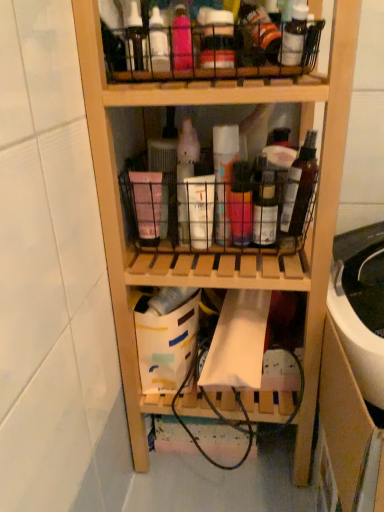
Question: From a real-world perspective, is metallic wire basket at upper center, marked as the 2th shelf in a bottom-to-top arrangement, above or below translucent plastic spray can at center, acting as the fourth bottle starting from the right?

Choices:
 (A) above
 (B) below

Answer: (A)

Question: In terms of height, does metallic wire basket at upper center, the first shelf in the top-to-bottom sequence, look taller or shorter compared to translucent plastic spray can at center, which is the first bottle in left-to-right order?

Choices:
 (A) short
 (B) tall

Answer: (A)

Question: Based on their relative distances, which object is nearer to the metallic wire basket at upper center, marked as the 2th shelf in a bottom-to-top arrangement?

Choices:
 (A) wooden shelf at center, which ranks as the second shelf in top-to-bottom order
 (B) translucent plastic spray can at center, which is the first bottle in left-to-right order
 (C) pink matte spray can at center, which ranks as the second bottle in right-to-left order
 (D) pink matte basket at center
 (E) wooden drawer at lower right

Answer: (A)

Question: Which is farther from the white matte spray can at center, acting as the second bottle starting from the left?

Choices:
 (A) translucent plastic bottle at center, the first bottle viewed from the right
 (B) wooden drawer at lower right
 (C) pink matte basket at center
 (D) wooden shelf at center, placed as the 1th shelf when sorted from bottom to top
 (E) metallic wire basket at upper center, the first shelf in the top-to-bottom sequence

Answer: (B)